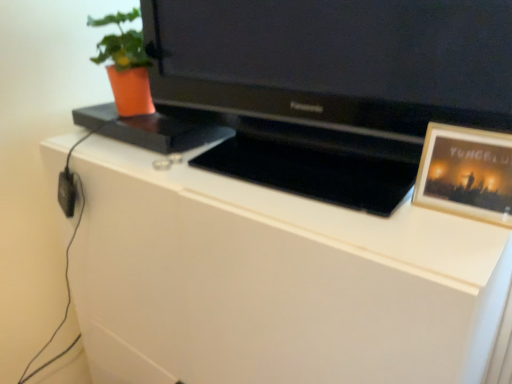
Locate an element on the screen. The height and width of the screenshot is (384, 512). free spot below black glossy television at center (from a real-world perspective) is located at coordinates (305, 176).